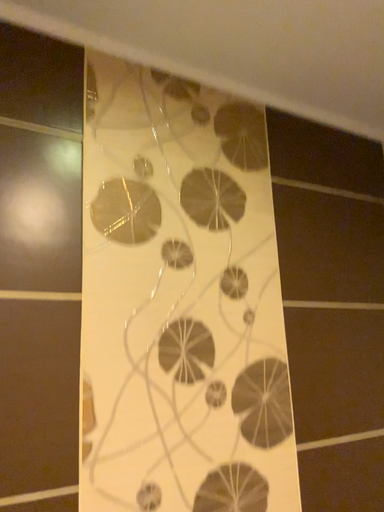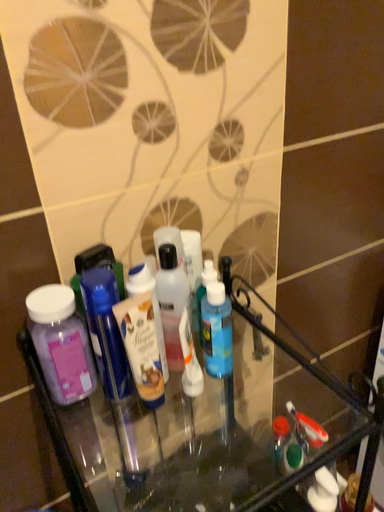
Question: How did the camera likely rotate when shooting the video?

Choices:
 (A) rotated upward
 (B) rotated downward

Answer: (B)